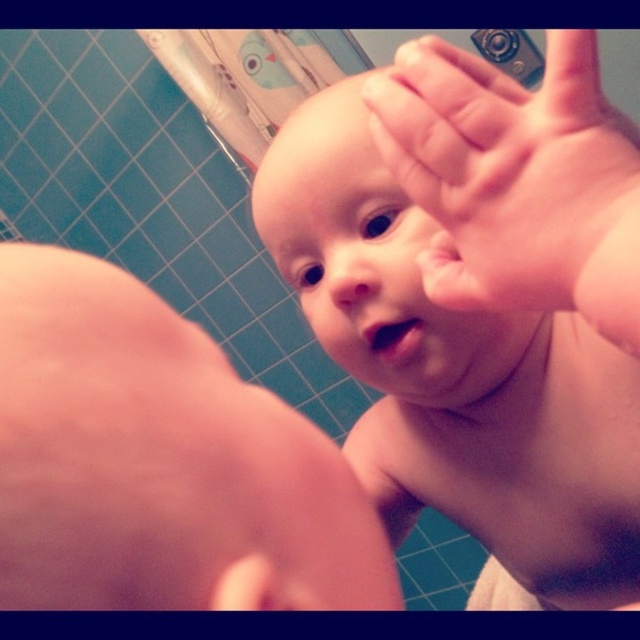
You are a photographer taking a close up shot of a baby in a bathroom. You notice the pink flesh baby at center and the pink flesh at lower left. Which one is taller?

The pink flesh baby at center is taller than the pink flesh at lower left.

You are a photographer taking a close up photo of the baby in the bathroom. You need to ensure both the pink flesh baby at center and the pink flesh at lower left are visible in the frame. Based on their positions, which one is closer to the bottom edge of the photo?

The pink flesh baby at center is closer to the bottom edge of the photo because it is positioned below the pink flesh at lower left.